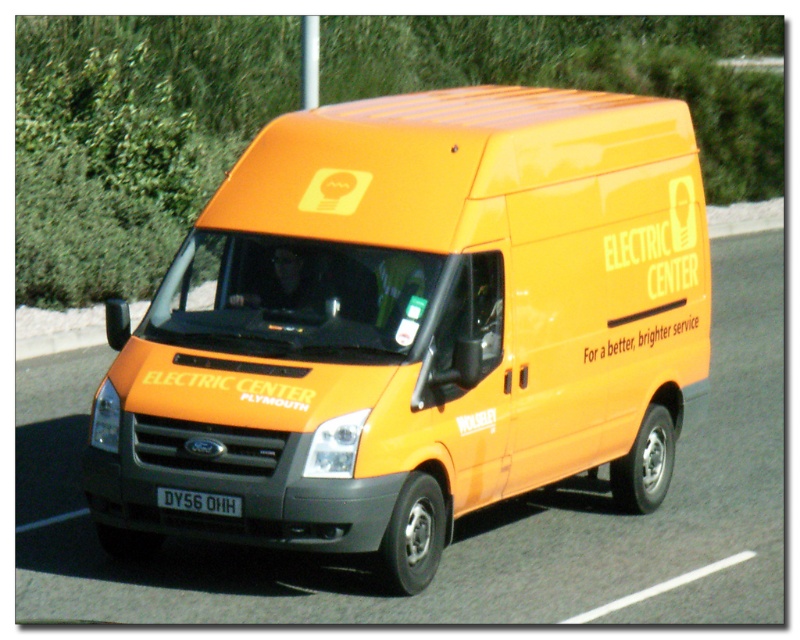
Is orange matte van at center positioned in front of black plastic license plate at center?

That is True.

Which is behind, point (316, 522) or point (222, 502)?

Point (222, 502)

You are a GUI agent. You are given a task and a screenshot of the screen. Output one action in this format:
    pyautogui.click(x=<x>, y=<y>)
    Task: Click on the orange matte van at center
    Image resolution: width=800 pixels, height=640 pixels.
    Given the screenshot: What is the action you would take?
    pyautogui.click(x=414, y=324)